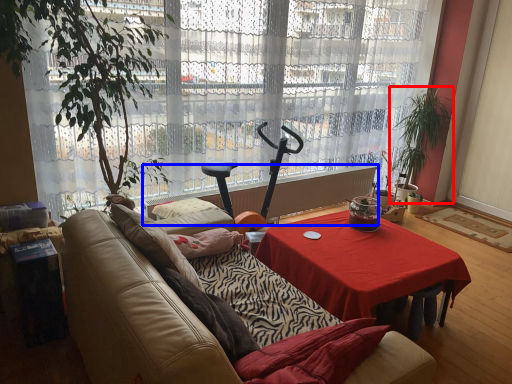
Question: Which of the following is the farthest to the observer, houseplant (highlighted by a red box) or radiator (highlighted by a blue box)?

Choices:
 (A) houseplant
 (B) radiator

Answer: (A)